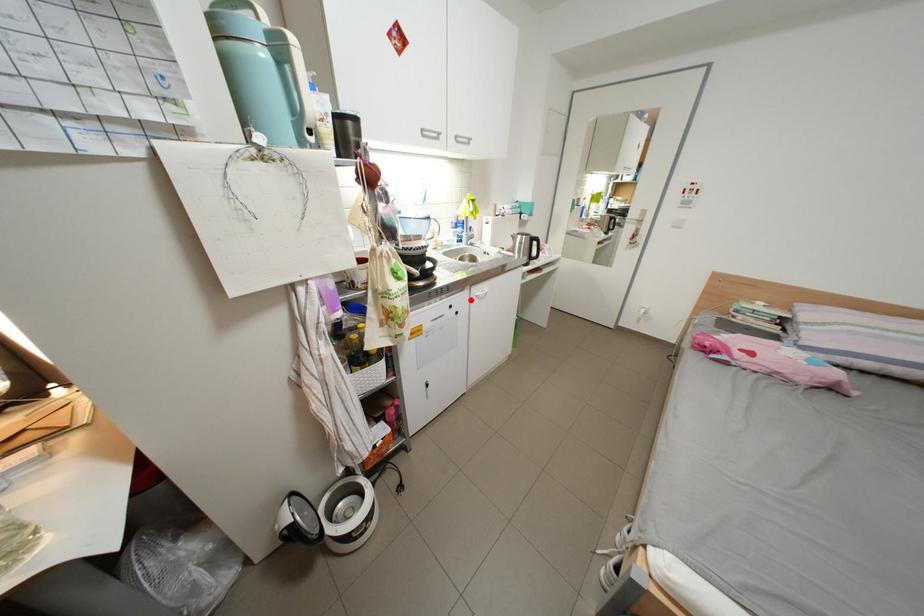
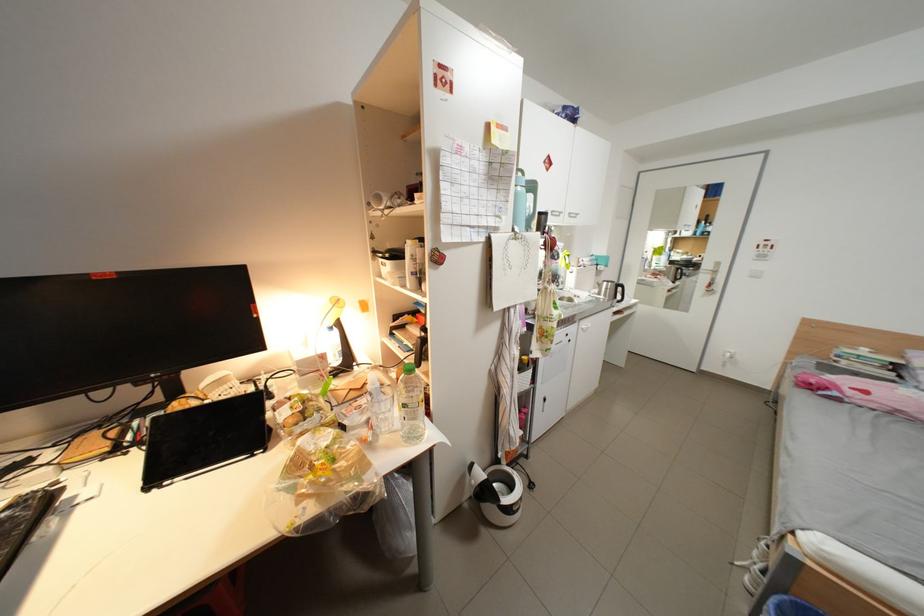
Question: I am providing you with two images of the same scene from different viewpoints. A red point is shown in image1. For the corresponding object point in image2, is it positioned nearer or farther from the camera?

Choices:
 (A) Nearer
 (B) Farther

Answer: (B)